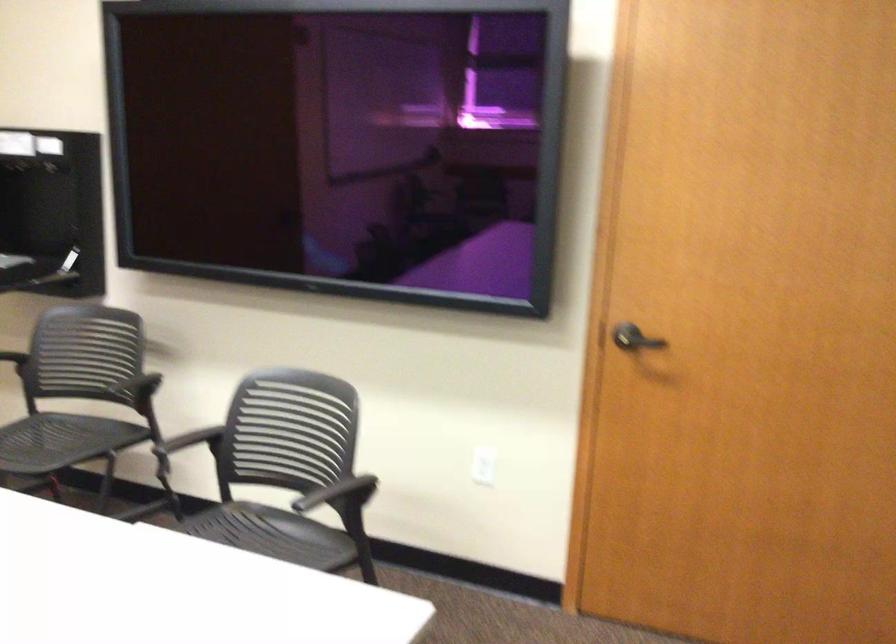
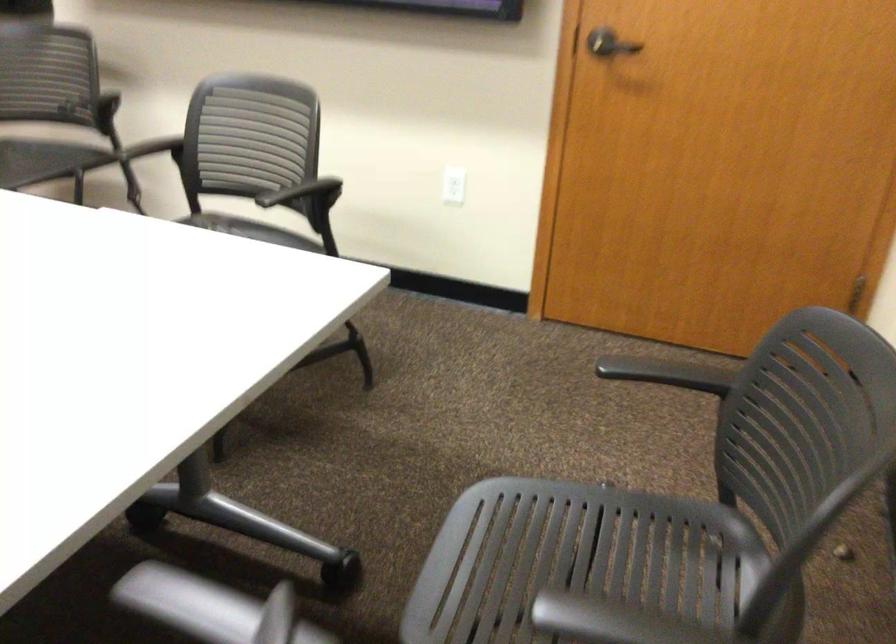
Which direction would the cameraman need to move to produce the second image?

The movement direction of the cameraman is right, backward.